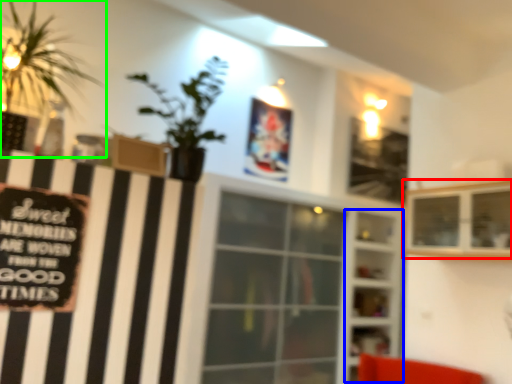
Question: Considering the real-world distances, which object is closest to shelf (highlighted by a red box)? shelf (highlighted by a blue box) or houseplant (highlighted by a green box).

Choices:
 (A) shelf
 (B) houseplant

Answer: (B)